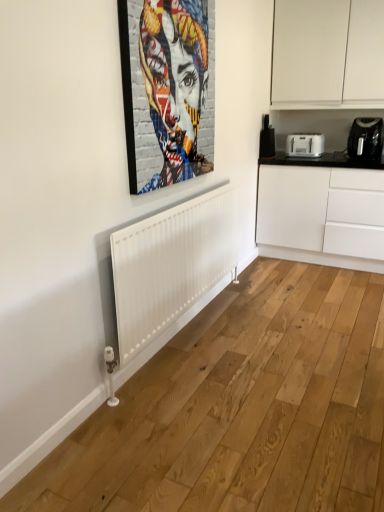
Consider the image. Measure the distance between black plastic toaster at upper right, the 1th appliance when ordered from left to right, and camera.

black plastic toaster at upper right, the 1th appliance when ordered from left to right, and camera are 3.69 meters apart.

How much space does black plastic toaster at upper right, the second appliance when ordered from right to left, occupy horizontally?

black plastic toaster at upper right, the second appliance when ordered from right to left, is 5.20 inches wide.

This screenshot has width=384, height=512. Find the location of `white plastic toaster at upper right`. white plastic toaster at upper right is located at coordinates (305, 145).

Where is `white matte cabinet at right, the first cabinetry ordered from the bottom`? white matte cabinet at right, the first cabinetry ordered from the bottom is located at coordinates (309, 216).

The image size is (384, 512). What do you see at coordinates (365, 138) in the screenshot? I see `black plastic toaster at upper right, which appears as the 1th appliance when viewed from the right` at bounding box center [365, 138].

How much space does black plastic toaster at upper right, which appears as the 1th appliance when viewed from the right, occupy horizontally?

It is 13.98 inches.

Find the location of a particular element. This screenshot has height=512, width=384. white matte cabinet at upper right, placed as the second cabinetry when sorted from bottom to top is located at coordinates (328, 53).

The height and width of the screenshot is (512, 384). Identify the location of black plastic toaster at upper right, the second appliance when ordered from right to left. (267, 140).

From the image's perspective, is black plastic toaster at upper right, which appears as the 1th appliance when viewed from the right, located above or below black plastic toaster at upper right, the second appliance when ordered from right to left?

From the image's perspective, black plastic toaster at upper right, which appears as the 1th appliance when viewed from the right, appears below black plastic toaster at upper right, the second appliance when ordered from right to left.

Which of these two, black plastic toaster at upper right, which appears as the 1th appliance when viewed from the right, or black plastic toaster at upper right, the 1th appliance when ordered from left to right, is bigger?

Bigger between the two is black plastic toaster at upper right, which appears as the 1th appliance when viewed from the right.

From a real-world perspective, which object rests below the other?

black plastic toaster at upper right, the second appliance when ordered from right to left, from a real-world perspective.

Which object is positioned more to the left, black plastic toaster at upper right, which appears as the 1th appliance when viewed from the right, or black plastic toaster at upper right, the 1th appliance when ordered from left to right?

black plastic toaster at upper right, the 1th appliance when ordered from left to right, is more to the left.

Identify the location of toaster behind the black plastic toaster at upper right, placed as the 2th appliance when sorted from left to right. (305, 145).

Can you tell me how much black plastic toaster at upper right, placed as the 2th appliance when sorted from left to right, and white plastic toaster at upper right differ in facing direction?

black plastic toaster at upper right, placed as the 2th appliance when sorted from left to right, and white plastic toaster at upper right are facing 0.0012 degrees away from each other.

Is point (375, 158) closer or farther from the camera than point (311, 147)?

Point (375, 158) appears to be closer to the viewer than point (311, 147).

Looking at this image, from their relative heights in the image, would you say black plastic toaster at upper right, placed as the 2th appliance when sorted from left to right, is taller or shorter than white plastic toaster at upper right?

In the image, black plastic toaster at upper right, placed as the 2th appliance when sorted from left to right, appears to be taller than white plastic toaster at upper right.

From a real-world perspective, is black plastic toaster at upper right, the second appliance when ordered from right to left, over white plastic toaster at upper right?

Indeed, from a real-world perspective, black plastic toaster at upper right, the second appliance when ordered from right to left, stands above white plastic toaster at upper right.

Identify the location of appliance behind the white plastic toaster at upper right. (267, 140).

Could white plastic toaster at upper right be considered to be inside black plastic toaster at upper right, the 1th appliance when ordered from left to right?

No.

From the image's perspective, would you say black plastic toaster at upper right, the 1th appliance when ordered from left to right, is positioned over white plastic toaster at upper right?

Yes, from the image's perspective, black plastic toaster at upper right, the 1th appliance when ordered from left to right, is over white plastic toaster at upper right.

From the image's perspective, is white matte cabinet at upper right, placed as the second cabinetry when sorted from bottom to top, located beneath white matte cabinet at right, marked as the second cabinetry in a top-to-bottom arrangement?

Actually, white matte cabinet at upper right, placed as the second cabinetry when sorted from bottom to top, appears above white matte cabinet at right, marked as the second cabinetry in a top-to-bottom arrangement, in the image.

Does point (359, 79) appear closer or farther from the camera than point (332, 191)?

Point (359, 79) is positioned closer to the camera compared to point (332, 191).

Choose the correct answer: Is white matte cabinet at upper right, placed as the second cabinetry when sorted from bottom to top, inside white matte cabinet at right, marked as the second cabinetry in a top-to-bottom arrangement, or outside it?

white matte cabinet at upper right, placed as the second cabinetry when sorted from bottom to top, is not enclosed by white matte cabinet at right, marked as the second cabinetry in a top-to-bottom arrangement.

Does black plastic toaster at upper right, the 1th appliance when ordered from left to right, lie in front of white matte cabinet at right, marked as the second cabinetry in a top-to-bottom arrangement?

No, black plastic toaster at upper right, the 1th appliance when ordered from left to right, is further to the viewer.

Which is more to the right, black plastic toaster at upper right, the 1th appliance when ordered from left to right, or white matte cabinet at right, marked as the second cabinetry in a top-to-bottom arrangement?

Positioned to the right is white matte cabinet at right, marked as the second cabinetry in a top-to-bottom arrangement.

Are black plastic toaster at upper right, the second appliance when ordered from right to left, and white matte cabinet at right, the first cabinetry ordered from the bottom, making contact?

No, black plastic toaster at upper right, the second appliance when ordered from right to left, is not touching white matte cabinet at right, the first cabinetry ordered from the bottom.

Relative to metallic silver picture frame at upper center, is black plastic toaster at upper right, the 1th appliance when ordered from left to right, in front or behind?

black plastic toaster at upper right, the 1th appliance when ordered from left to right, is positioned farther from the viewer than metallic silver picture frame at upper center.

Considering the sizes of objects black plastic toaster at upper right, the second appliance when ordered from right to left, and metallic silver picture frame at upper center in the image provided, who is shorter, black plastic toaster at upper right, the second appliance when ordered from right to left, or metallic silver picture frame at upper center?

black plastic toaster at upper right, the second appliance when ordered from right to left.

Can you confirm if black plastic toaster at upper right, the second appliance when ordered from right to left, is positioned to the right of metallic silver picture frame at upper center?

Yes.

The height and width of the screenshot is (512, 384). Find the location of `the 2nd appliance above the metallic silver picture frame at upper center (from the image's perspective)`. the 2nd appliance above the metallic silver picture frame at upper center (from the image's perspective) is located at coordinates (267, 140).

Is white matte cabinet at upper right, the 1th cabinetry from the top, completely or partially outside of black plastic toaster at upper right, placed as the 2th appliance when sorted from left to right?

Indeed, white matte cabinet at upper right, the 1th cabinetry from the top, is completely outside black plastic toaster at upper right, placed as the 2th appliance when sorted from left to right.

From the image's perspective, would you say white matte cabinet at upper right, the 1th cabinetry from the top, is shown under black plastic toaster at upper right, placed as the 2th appliance when sorted from left to right?

No.

Between point (290, 97) and point (376, 157), which one is positioned in front?

The point (376, 157) is closer.

From their relative heights in the image, would you say white matte cabinet at upper right, placed as the second cabinetry when sorted from bottom to top, is taller or shorter than black plastic toaster at upper right, placed as the 2th appliance when sorted from left to right?

white matte cabinet at upper right, placed as the second cabinetry when sorted from bottom to top, is taller than black plastic toaster at upper right, placed as the 2th appliance when sorted from left to right.

Identify the location of appliance on the right side of black plastic toaster at upper right, the 1th appliance when ordered from left to right. (365, 138).

What are the coordinates of `toaster lying above the black plastic toaster at upper right, placed as the 2th appliance when sorted from left to right (from the image's perspective)` in the screenshot? It's located at (305, 145).

Considering their positions, is white plastic toaster at upper right positioned further to black plastic toaster at upper right, the 1th appliance when ordered from left to right, than white matte cabinet at upper right, placed as the second cabinetry when sorted from bottom to top?

white matte cabinet at upper right, placed as the second cabinetry when sorted from bottom to top, lies further to black plastic toaster at upper right, the 1th appliance when ordered from left to right, than the other object.

Based on their spatial positions, is white plastic toaster at upper right or metallic silver picture frame at upper center closer to white matte cabinet at upper right, placed as the second cabinetry when sorted from bottom to top?

Among the two, white plastic toaster at upper right is located nearer to white matte cabinet at upper right, placed as the second cabinetry when sorted from bottom to top.

Considering their positions, is white matte cabinet at right, marked as the second cabinetry in a top-to-bottom arrangement, positioned further to white plastic toaster at upper right than black plastic toaster at upper right, placed as the 2th appliance when sorted from left to right?

white matte cabinet at right, marked as the second cabinetry in a top-to-bottom arrangement, lies further to white plastic toaster at upper right than the other object.

Considering their positions, is white plastic toaster at upper right positioned closer to black plastic toaster at upper right, which appears as the 1th appliance when viewed from the right, than metallic silver picture frame at upper center?

white plastic toaster at upper right is positioned closer to the anchor black plastic toaster at upper right, which appears as the 1th appliance when viewed from the right.

When comparing their distances from black plastic toaster at upper right, which appears as the 1th appliance when viewed from the right, does black plastic toaster at upper right, the 1th appliance when ordered from left to right, or metallic silver picture frame at upper center seem closer?

black plastic toaster at upper right, the 1th appliance when ordered from left to right.

When comparing their distances from white matte cabinet at upper right, placed as the second cabinetry when sorted from bottom to top, does white matte cabinet at right, marked as the second cabinetry in a top-to-bottom arrangement, or black plastic toaster at upper right, the second appliance when ordered from right to left, seem further?

white matte cabinet at right, marked as the second cabinetry in a top-to-bottom arrangement, is positioned further to the anchor white matte cabinet at upper right, placed as the second cabinetry when sorted from bottom to top.

Estimate the real-world distances between objects in this image. Which object is further from black plastic toaster at upper right, placed as the 2th appliance when sorted from left to right, white plastic toaster at upper right or white matte cabinet at upper right, placed as the second cabinetry when sorted from bottom to top?

white matte cabinet at upper right, placed as the second cabinetry when sorted from bottom to top, is further to black plastic toaster at upper right, placed as the 2th appliance when sorted from left to right.

Consider the image. When comparing their distances from white matte cabinet at upper right, placed as the second cabinetry when sorted from bottom to top, does metallic silver picture frame at upper center or black plastic toaster at upper right, placed as the 2th appliance when sorted from left to right, seem closer?

The object closer to white matte cabinet at upper right, placed as the second cabinetry when sorted from bottom to top, is black plastic toaster at upper right, placed as the 2th appliance when sorted from left to right.

At what (x,y) coordinates should I click in order to perform the action: click on appliance between white plastic toaster at upper right and white matte cabinet at right, marked as the second cabinetry in a top-to-bottom arrangement, vertically. Please return your answer as a coordinate pair (x, y). The height and width of the screenshot is (512, 384). Looking at the image, I should click on (365, 138).

The width and height of the screenshot is (384, 512). Identify the location of toaster that lies between white matte cabinet at upper right, the 1th cabinetry from the top, and black plastic toaster at upper right, which appears as the 1th appliance when viewed from the right, from top to bottom. (305, 145).

The image size is (384, 512). Find the location of `toaster situated between black plastic toaster at upper right, the second appliance when ordered from right to left, and black plastic toaster at upper right, which appears as the 1th appliance when viewed from the right, from left to right`. toaster situated between black plastic toaster at upper right, the second appliance when ordered from right to left, and black plastic toaster at upper right, which appears as the 1th appliance when viewed from the right, from left to right is located at coordinates (305, 145).

The image size is (384, 512). What are the coordinates of `appliance between metallic silver picture frame at upper center and black plastic toaster at upper right, the second appliance when ordered from right to left, along the z-axis` in the screenshot? It's located at (365, 138).